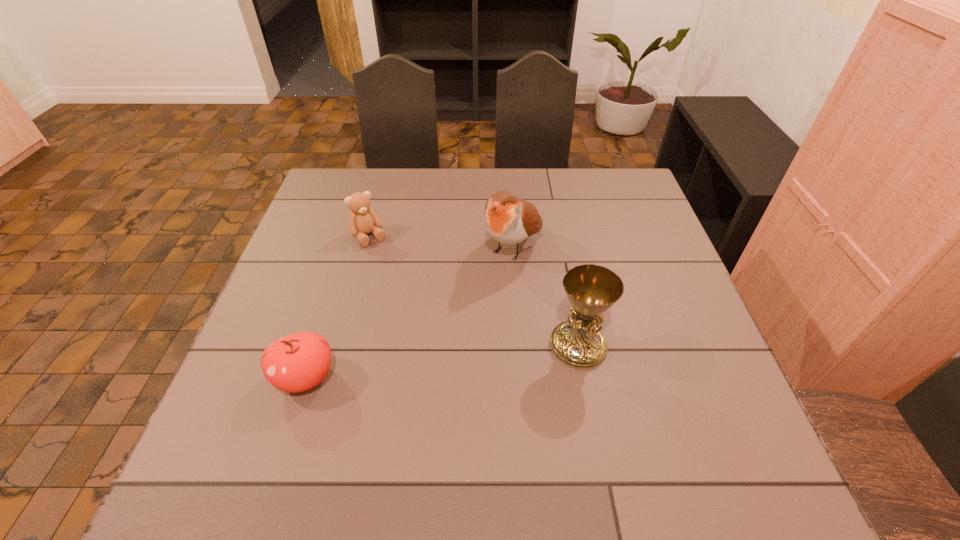
The width and height of the screenshot is (960, 540). I want to click on vacant space on the desktop that is between the apple and the chalice and is positioned on the front-facing side of the teddy bear, so click(x=451, y=360).

Find the location of `vacant space on the desktop that is between the apple and the chalice and is positioned at the face of the bird`. vacant space on the desktop that is between the apple and the chalice and is positioned at the face of the bird is located at coordinates (420, 364).